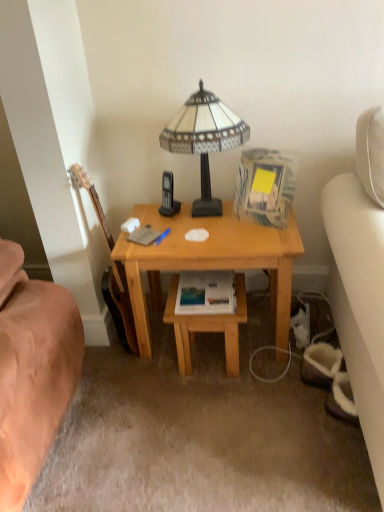
This screenshot has width=384, height=512. I want to click on empty space that is ontop of wooden desk at center (from a real-world perspective), so click(x=193, y=225).